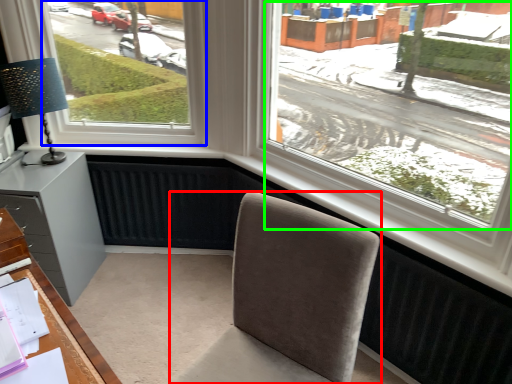
Question: Which object is the closest to the chair (highlighted by a red box)? Choose among these: window (highlighted by a blue box) or window screen (highlighted by a green box).

Choices:
 (A) window
 (B) window screen

Answer: (B)